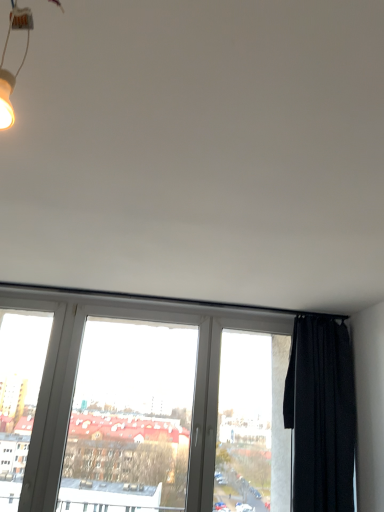
Question: From a real-world perspective, is white plastic window at center above or below black matte curtain at right?

Choices:
 (A) above
 (B) below

Answer: (B)

Question: Considering the relative positions of white plastic window at center and black matte curtain at right in the image provided, is white plastic window at center to the left or to the right of black matte curtain at right?

Choices:
 (A) left
 (B) right

Answer: (A)

Question: Estimate the real-world distances between objects in this image. Which object is closer to the white plastic window frame at left?

Choices:
 (A) white plastic window at center
 (B) black matte curtain at right

Answer: (A)

Question: Based on their relative distances, which object is farther from the white plastic window at center?

Choices:
 (A) white plastic window frame at left
 (B) black matte curtain at right

Answer: (A)